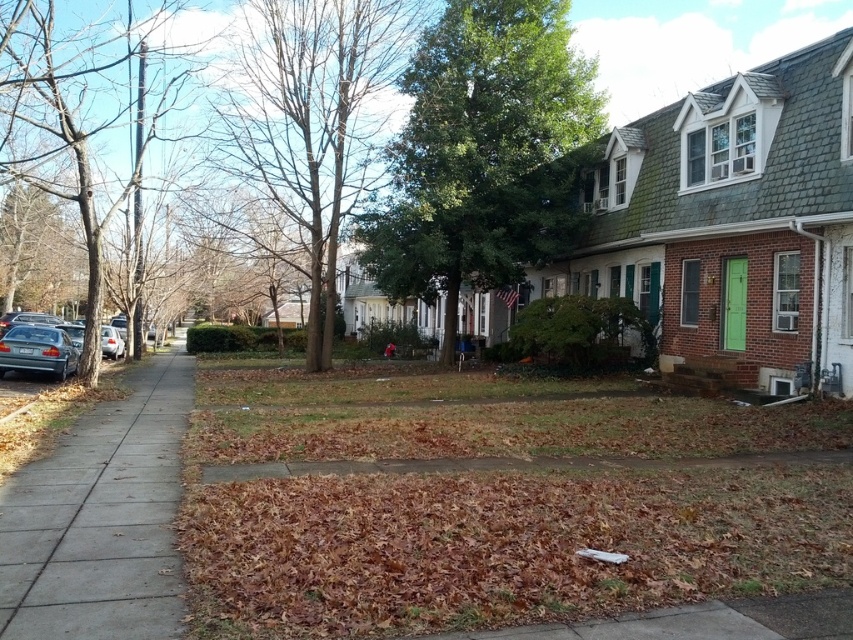
Question: Which point is closer to the camera?

Choices:
 (A) tap(376, 80)
 (B) tap(48, 362)

Answer: (B)

Question: Which of the following is the closest to the observer?

Choices:
 (A) (358, 163)
 (B) (136, 589)
 (C) (64, 257)
 (D) (541, 180)

Answer: (B)

Question: From the image, what is the correct spatial relationship of brown bark tree at left in relation to brown textured tree at upper left?

Choices:
 (A) right
 (B) left

Answer: (A)

Question: Does bare wood tree at center have a smaller size compared to brown bark tree at left?

Choices:
 (A) no
 (B) yes

Answer: (B)

Question: Which point is closer to the camera?

Choices:
 (A) green leafy tree at center
 (B) metallic blue sedan at left
 (C) brown bark tree at left
 (D) bare wood tree at center

Answer: (C)

Question: Is brown bark tree at left to the left of metallic blue sedan at left from the viewer's perspective?

Choices:
 (A) no
 (B) yes

Answer: (B)